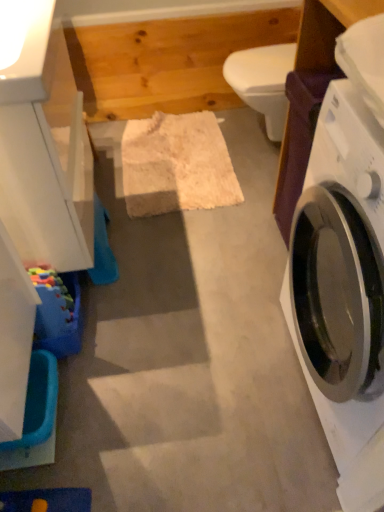
Question: Considering the relative sizes of white glossy toilet bowl at center and white glossy washing machine at right in the image provided, is white glossy toilet bowl at center smaller than white glossy washing machine at right?

Choices:
 (A) no
 (B) yes

Answer: (B)

Question: Is white glossy toilet bowl at center in contact with white glossy washing machine at right?

Choices:
 (A) no
 (B) yes

Answer: (A)

Question: Is white glossy toilet bowl at center closer to camera compared to white glossy washing machine at right?

Choices:
 (A) no
 (B) yes

Answer: (A)

Question: Is white glossy toilet bowl at center turned away from white glossy washing machine at right?

Choices:
 (A) yes
 (B) no

Answer: (B)

Question: Can white glossy washing machine at right be found inside white glossy toilet bowl at center?

Choices:
 (A) no
 (B) yes

Answer: (A)

Question: From the image's perspective, is blue plastic tub at lower left positioned above or below white glossy toilet bowl at center?

Choices:
 (A) above
 (B) below

Answer: (B)

Question: Considering the positions of blue plastic tub at lower left and white glossy toilet bowl at center in the image, is blue plastic tub at lower left wider or thinner than white glossy toilet bowl at center?

Choices:
 (A) wide
 (B) thin

Answer: (B)

Question: Is blue plastic tub at lower left in front of or behind white glossy toilet bowl at center in the image?

Choices:
 (A) behind
 (B) front

Answer: (B)

Question: Based on their sizes in the image, would you say blue plastic tub at lower left is bigger or smaller than white glossy toilet bowl at center?

Choices:
 (A) big
 (B) small

Answer: (B)

Question: Do you think white glossy toilet bowl at center is within white glossy washing machine at right, or outside of it?

Choices:
 (A) outside
 (B) inside

Answer: (A)

Question: Considering the positions of white glossy toilet bowl at center and white glossy washing machine at right in the image, is white glossy toilet bowl at center wider or thinner than white glossy washing machine at right?

Choices:
 (A) thin
 (B) wide

Answer: (A)

Question: Considering the relative positions of white glossy toilet bowl at center and white glossy washing machine at right in the image provided, is white glossy toilet bowl at center to the left or to the right of white glossy washing machine at right?

Choices:
 (A) left
 (B) right

Answer: (A)

Question: In the image, is white glossy toilet bowl at center positioned in front of or behind white glossy washing machine at right?

Choices:
 (A) front
 (B) behind

Answer: (B)

Question: Considering the positions of white glossy washing machine at right and white glossy toilet bowl at center in the image, is white glossy washing machine at right taller or shorter than white glossy toilet bowl at center?

Choices:
 (A) tall
 (B) short

Answer: (A)

Question: Looking at the image, does white glossy washing machine at right seem bigger or smaller compared to white glossy toilet bowl at center?

Choices:
 (A) big
 (B) small

Answer: (A)